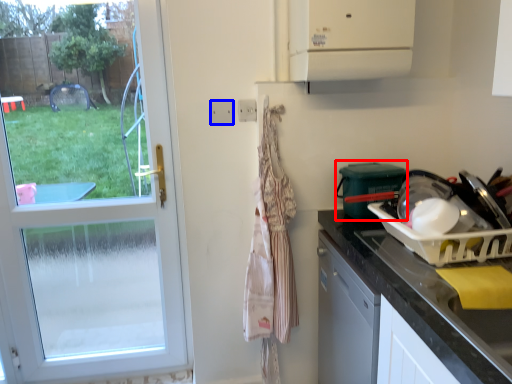
Question: Which of the following is the farthest to the observer, appliance (highlighted by a red box) or electric outlet (highlighted by a blue box)?

Choices:
 (A) appliance
 (B) electric outlet

Answer: (B)